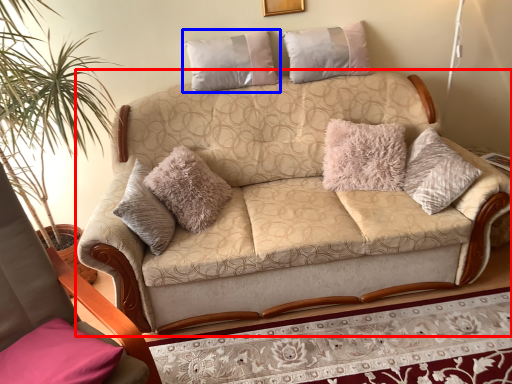
Question: Which point is further to the camera, studio couch (highlighted by a red box) or pillow (highlighted by a blue box)?

Choices:
 (A) studio couch
 (B) pillow

Answer: (B)